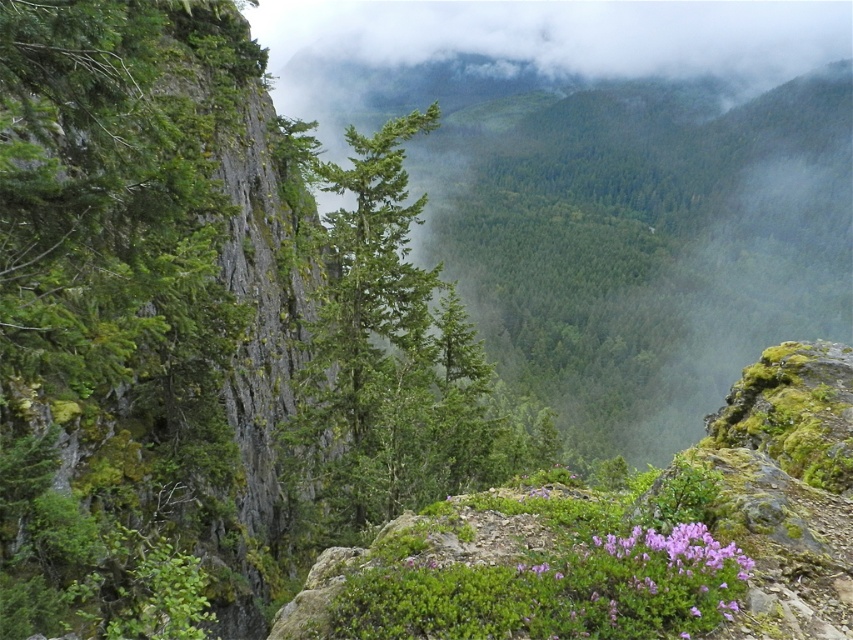
Question: Which of the following is the farthest from the observer?

Choices:
 (A) (697, 602)
 (B) (543, 422)

Answer: (B)

Question: Which object is farther from the camera taking this photo?

Choices:
 (A) green matte tree at center
 (B) purple matte flower at lower right

Answer: (A)

Question: From the image, what is the correct spatial relationship of green matte tree at center in relation to purple matte flower at lower right?

Choices:
 (A) left
 (B) right

Answer: (A)

Question: Is green matte tree at center positioned behind purple matte flower at lower right?

Choices:
 (A) yes
 (B) no

Answer: (A)

Question: Is green matte tree at center smaller than purple matte flower at lower right?

Choices:
 (A) yes
 (B) no

Answer: (B)